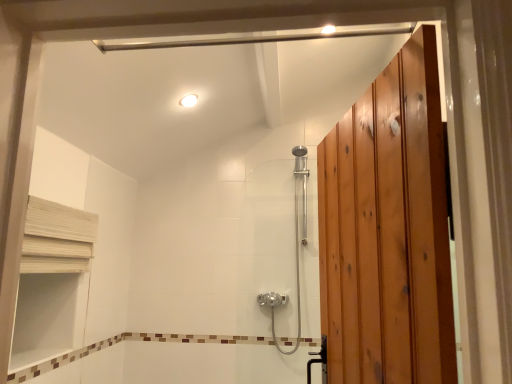
Question: From the image's perspective, is polished chrome shower door at center over white glossy light fixture at upper center?

Choices:
 (A) no
 (B) yes

Answer: (A)

Question: From a real-world perspective, is polished chrome shower door at center below white glossy light fixture at upper center?

Choices:
 (A) no
 (B) yes

Answer: (B)

Question: Is polished chrome shower door at center completely or partially outside of white glossy light fixture at upper center?

Choices:
 (A) no
 (B) yes

Answer: (B)

Question: Considering the relative sizes of polished chrome shower door at center and white glossy light fixture at upper center in the image provided, is polished chrome shower door at center shorter than white glossy light fixture at upper center?

Choices:
 (A) yes
 (B) no

Answer: (B)

Question: Is polished chrome shower door at center not close to white glossy light fixture at upper center?

Choices:
 (A) no
 (B) yes

Answer: (B)

Question: Does polished chrome shower door at center turn towards white glossy light fixture at upper center?

Choices:
 (A) yes
 (B) no

Answer: (B)

Question: From a real-world perspective, does white glossy light fixture at upper center stand above white wood shelf at upper left?

Choices:
 (A) no
 (B) yes

Answer: (B)

Question: Is the depth of white glossy light fixture at upper center less than that of white wood shelf at upper left?

Choices:
 (A) yes
 (B) no

Answer: (B)

Question: Is white glossy light fixture at upper center further to camera compared to white wood shelf at upper left?

Choices:
 (A) yes
 (B) no

Answer: (A)

Question: Does white glossy light fixture at upper center have a smaller size compared to white wood shelf at upper left?

Choices:
 (A) yes
 (B) no

Answer: (A)

Question: Does white glossy light fixture at upper center have a greater width compared to white wood shelf at upper left?

Choices:
 (A) no
 (B) yes

Answer: (B)

Question: From the image's perspective, is white glossy light fixture at upper center above white wood shelf at upper left?

Choices:
 (A) yes
 (B) no

Answer: (A)

Question: Is white glossy light fixture at upper center located outside polished chrome shower door at center?

Choices:
 (A) no
 (B) yes

Answer: (B)